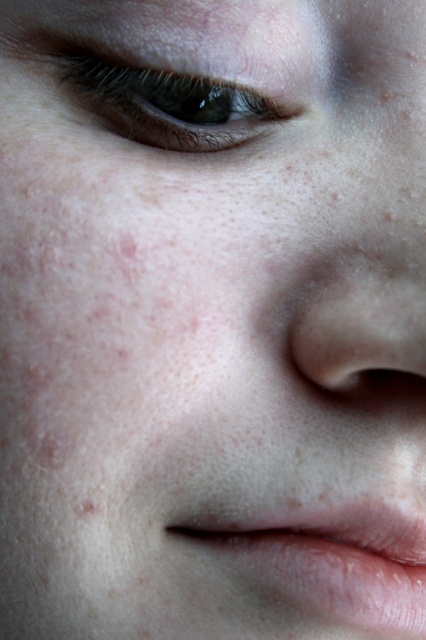
Can you confirm if pink smooth lips at lower center is shorter than smooth skin nose at center?

No, pink smooth lips at lower center is not shorter than smooth skin nose at center.

Can you confirm if pink smooth lips at lower center is thinner than smooth skin nose at center?

No, pink smooth lips at lower center is not thinner than smooth skin nose at center.

Does point (279, 515) come farther from viewer compared to point (388, 273)?

Yes, it is.

Locate an element on the screen. This screenshot has height=640, width=426. pink smooth lips at lower center is located at coordinates (325, 557).

The image size is (426, 640). What do you see at coordinates (325, 557) in the screenshot?
I see `pink smooth lips at lower center` at bounding box center [325, 557].

Is pink smooth lips at lower center thinner than brown matte eye at upper left?

No.

Which is behind, point (293, 605) or point (109, 125)?

Positioned behind is point (109, 125).

Where is `pink smooth lips at lower center`? This screenshot has width=426, height=640. pink smooth lips at lower center is located at coordinates (325, 557).

Is smooth skin nose at center below brown matte eye at upper left?

Correct, smooth skin nose at center is located below brown matte eye at upper left.

Is point (388, 328) positioned behind point (233, 90)?

That is False.

Locate an element on the screen. smooth skin nose at center is located at coordinates (362, 317).

Locate an element on the screen. smooth skin nose at center is located at coordinates (362, 317).